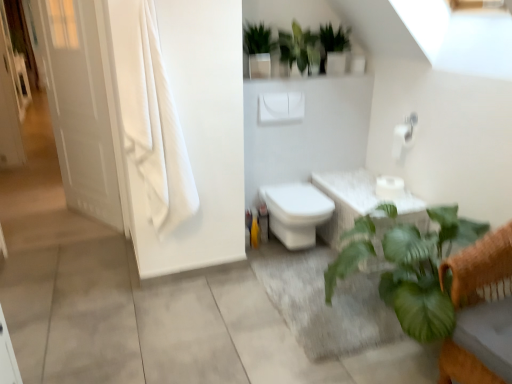
Question: Does green matte plant at upper center, the third vegetation positioned from the left, have a greater width compared to green glossy plant at upper center, which appears as the second vegetation when viewed from the left?

Choices:
 (A) yes
 (B) no

Answer: (B)

Question: Is green matte plant at upper center, which is the 1th vegetation from right to left, further to the viewer compared to green glossy plant at upper center, which is the 2th vegetation in right-to-left order?

Choices:
 (A) no
 (B) yes

Answer: (B)

Question: From a real-world perspective, is green matte plant at upper center, which is the 1th vegetation from right to left, physically above green glossy plant at upper center, which is the 2th vegetation in right-to-left order?

Choices:
 (A) yes
 (B) no

Answer: (B)

Question: Does green matte plant at upper center, which is the 1th vegetation from right to left, have a greater height compared to green glossy plant at upper center, which is the 2th vegetation in right-to-left order?

Choices:
 (A) no
 (B) yes

Answer: (A)

Question: Can you confirm if green matte plant at upper center, the third vegetation positioned from the left, is shorter than green glossy plant at upper center, which appears as the second vegetation when viewed from the left?

Choices:
 (A) yes
 (B) no

Answer: (A)

Question: From the image's perspective, is white matte toilet paper at upper right, the 2th toilet paper ordered from the bottom, located above or below green leafy plant at lower right?

Choices:
 (A) below
 (B) above

Answer: (B)

Question: From a real-world perspective, is white matte toilet paper at upper right, the 1th toilet paper from the top, physically located above or below green leafy plant at lower right?

Choices:
 (A) below
 (B) above

Answer: (B)

Question: From their relative heights in the image, would you say white matte toilet paper at upper right, the 2th toilet paper ordered from the bottom, is taller or shorter than green leafy plant at lower right?

Choices:
 (A) short
 (B) tall

Answer: (A)

Question: Is white matte toilet paper at upper right, the 2th toilet paper ordered from the bottom, wider or thinner than green leafy plant at lower right?

Choices:
 (A) wide
 (B) thin

Answer: (B)

Question: Based on their sizes in the image, would you say green leafy plant at lower right is bigger or smaller than white glossy door at left?

Choices:
 (A) small
 (B) big

Answer: (B)

Question: Is green leafy plant at lower right wider or thinner than white glossy door at left?

Choices:
 (A) thin
 (B) wide

Answer: (B)

Question: Is green leafy plant at lower right to the left or to the right of white glossy door at left in the image?

Choices:
 (A) right
 (B) left

Answer: (A)

Question: Is point (354, 261) positioned closer to the camera than point (71, 99)?

Choices:
 (A) farther
 (B) closer

Answer: (B)

Question: From a real-world perspective, is green glossy plant at upper center, which appears as the second vegetation when viewed from the left, above or below green matte plant at upper center, which is the 1th vegetation from right to left?

Choices:
 (A) above
 (B) below

Answer: (A)

Question: Is green glossy plant at upper center, which is the 2th vegetation in right-to-left order, in front of or behind green matte plant at upper center, which is the 1th vegetation from right to left, in the image?

Choices:
 (A) front
 (B) behind

Answer: (A)